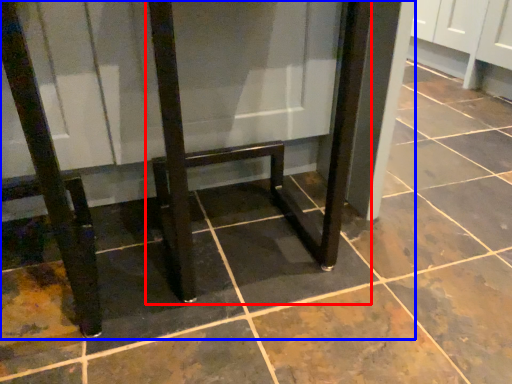
Question: Which point is further to the camera, furniture (highlighted by a red box) or furniture (highlighted by a blue box)?

Choices:
 (A) furniture
 (B) furniture

Answer: (A)